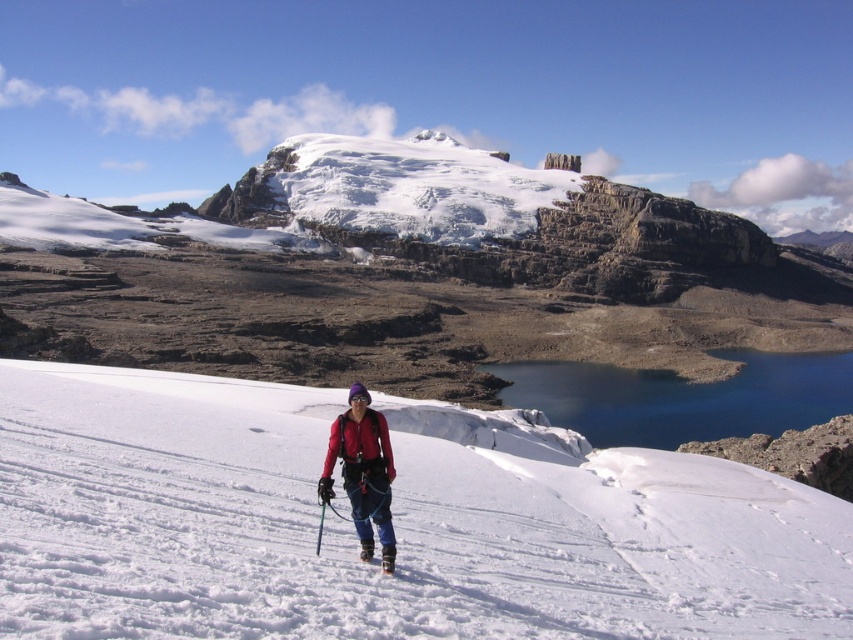
Which of these two, white snow at center or white matte ski at lower center, stands taller?

With more height is white snow at center.

Can you confirm if white snow at center is positioned to the right of white matte ski at lower center?

Yes, white snow at center is to the right of white matte ski at lower center.

Where is `white snow at center`? The width and height of the screenshot is (853, 640). white snow at center is located at coordinates (393, 524).

Does white snow at center have a greater height compared to blue glassy lake at center?

Yes, white snow at center is taller than blue glassy lake at center.

Which of these two, white snow at center or blue glassy lake at center, stands shorter?

With less height is blue glassy lake at center.

Is point (592, 522) positioned behind point (670, 387)?

No, it is not.

Where is `white snow at center`? This screenshot has width=853, height=640. white snow at center is located at coordinates (x=393, y=524).

Does point (728, 417) come farther from viewer compared to point (364, 541)?

Yes, point (728, 417) is farther from viewer.

Between blue glassy lake at center and white matte ski at lower center, which one is positioned higher?

Positioned higher is blue glassy lake at center.

I want to click on blue glassy lake at center, so click(x=682, y=397).